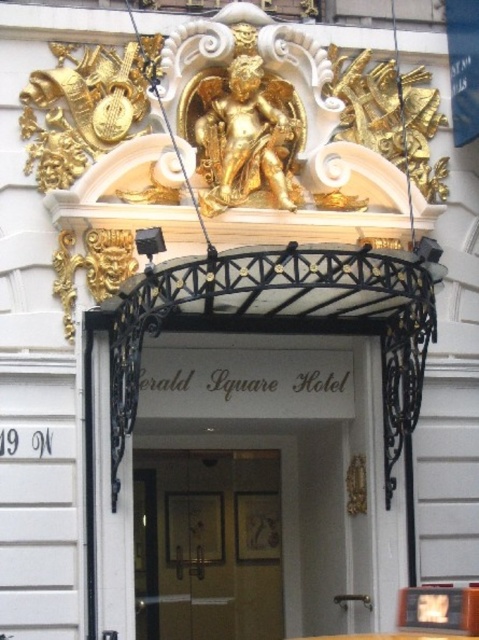
You are standing in front of the Gerald Square Hotel entrance. You see a white glossy door at center and a wooden door at center. Which door is positioned to the right?

The white glossy door at center is to the right of the wooden door at center.

Looking at this image, you are a hotel guest arriving at the Gerald Square Hotel. You see the white glossy door at center and the wooden door at center. Which door should you use to enter the hotel?

The white glossy door at center is larger in size than the wooden door at center, so you should use the white glossy door at center to enter the hotel.

You are a hotel guest who just arrived at the Gerald Square Hotel. You see the white glossy door at center and the wooden door at center. Which door should you use to enter the hotel?

The white glossy door at center is much taller than the wooden door at center, so it is likely the main entrance. You should use the white glossy door at center to enter the hotel.